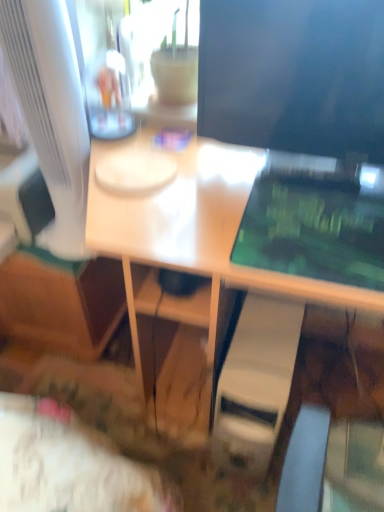
Question: Considering the positions of point (114, 177) and point (38, 9), is point (114, 177) closer or farther from the camera than point (38, 9)?

Choices:
 (A) closer
 (B) farther

Answer: (B)

Question: Considering the positions of white glossy desk at center and white glossy computer monitor at left, positioned as the 1th computer monitor in left-to-right order, in the image, is white glossy desk at center wider or thinner than white glossy computer monitor at left, positioned as the 1th computer monitor in left-to-right order,?

Choices:
 (A) wide
 (B) thin

Answer: (A)

Question: Considering the real-world distances, which object is closest to the white plastic computer tower at lower center?

Choices:
 (A) white glossy desk at center
 (B) matte black monitor at upper right, the second computer monitor when ordered from left to right
 (C) white glossy computer monitor at left, the second computer monitor from the right

Answer: (A)

Question: Which object is positioned closest to the white glossy desk at center?

Choices:
 (A) matte black monitor at upper right, which appears as the first computer monitor when viewed from the right
 (B) white plastic computer tower at lower center
 (C) white glossy computer monitor at left, positioned as the 1th computer monitor in left-to-right order

Answer: (A)